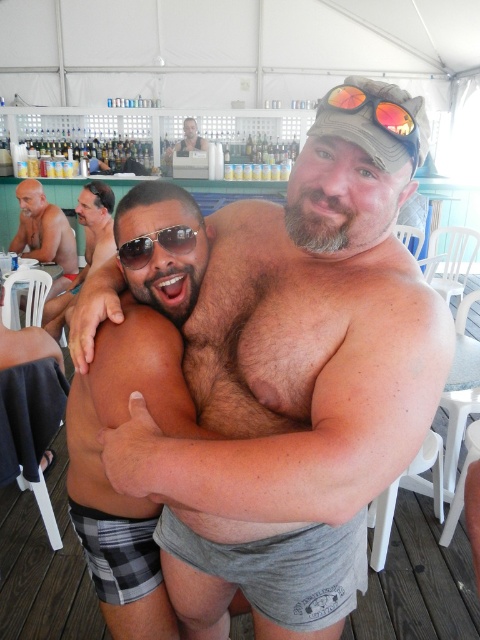
You are a photographer trying to capture a closeup of the bald head at left and the smooth skin man at center. Since you can only focus on one subject at a time, which one should you choose to ensure the other is still in the frame?

The bald head at left is positioned on the left side of smooth skin man at center, so focusing on the smooth skin man at center would keep the bald head at left within the frame as well.

You are a photographer at the event and need to capture a closeup shot of the sunglasses at center without the gray fabric shorts at center appearing in the frame. Is this possible given their sizes?

The gray fabric shorts at center has a larger size compared to sunglasses at center. Therefore, it might be challenging to capture a closeup of the sunglasses at center without the gray fabric shorts at center appearing in the frame due to their size difference.

You are a photographer trying to capture a closeup of the gray fabric shorts at center and the sunglasses at center. Which object should you zoom in on to ensure both are in focus without moving the camera?

The gray fabric shorts at center is wider than the sunglasses at center, so you should zoom in on the sunglasses at center to ensure both are in focus without moving the camera.